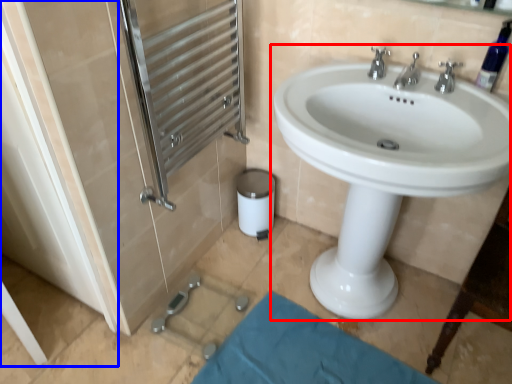
Question: Among these objects, which one is nearest to the camera, sink (highlighted by a red box) or screen door (highlighted by a blue box)?

Choices:
 (A) sink
 (B) screen door

Answer: (A)